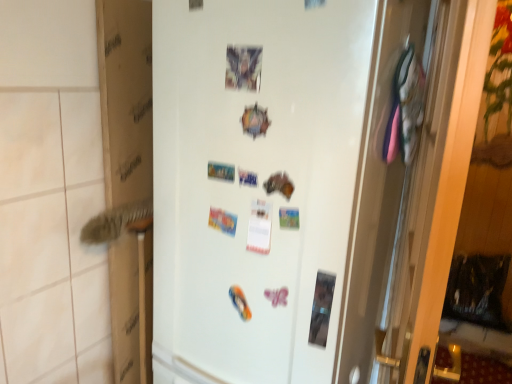
Question: From a real-world perspective, is white matte refrigerator at center below matte plastic postcard at upper center?

Choices:
 (A) no
 (B) yes

Answer: (B)

Question: From the image's perspective, is white matte refrigerator at center on matte plastic postcard at upper center?

Choices:
 (A) yes
 (B) no

Answer: (B)

Question: Is white matte refrigerator at center wider than matte plastic postcard at upper center?

Choices:
 (A) yes
 (B) no

Answer: (A)

Question: Considering the relative positions of white matte refrigerator at center and matte plastic postcard at upper center in the image provided, is white matte refrigerator at center to the right of matte plastic postcard at upper center from the viewer's perspective?

Choices:
 (A) yes
 (B) no

Answer: (A)

Question: Is white matte refrigerator at center facing away from matte plastic postcard at upper center?

Choices:
 (A) yes
 (B) no

Answer: (B)

Question: Considering the relative sizes of white matte refrigerator at center and matte plastic postcard at upper center in the image provided, is white matte refrigerator at center shorter than matte plastic postcard at upper center?

Choices:
 (A) yes
 (B) no

Answer: (B)

Question: Considering the relative sizes of matte plastic postcard at upper center and white matte refrigerator at center in the image provided, is matte plastic postcard at upper center bigger than white matte refrigerator at center?

Choices:
 (A) yes
 (B) no

Answer: (B)

Question: From the image's perspective, is matte plastic postcard at upper center below white matte refrigerator at center?

Choices:
 (A) no
 (B) yes

Answer: (A)

Question: Considering the relative sizes of matte plastic postcard at upper center and white matte refrigerator at center in the image provided, is matte plastic postcard at upper center shorter than white matte refrigerator at center?

Choices:
 (A) no
 (B) yes

Answer: (B)

Question: Is white matte refrigerator at center located within matte plastic postcard at upper center?

Choices:
 (A) yes
 (B) no

Answer: (B)

Question: Is matte plastic postcard at upper center outside white matte refrigerator at center?

Choices:
 (A) no
 (B) yes

Answer: (A)

Question: Is the position of matte plastic postcard at upper center more distant than that of white matte refrigerator at center?

Choices:
 (A) no
 (B) yes

Answer: (B)

Question: From the image's perspective, is cardboard at left below white matte refrigerator at center?

Choices:
 (A) yes
 (B) no

Answer: (B)